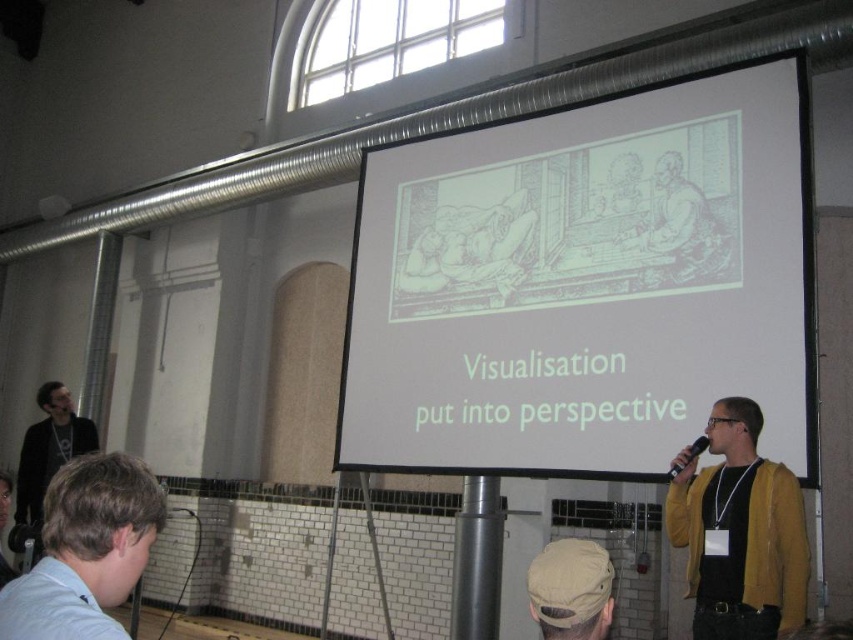
You are standing in the presentation room and want to locate the presenter wearing the yellow cardigan at right. According to the coordinates provided, where exactly should you look to find him?

You should look towards the right side of the image at point coordinates (740, 531) to find the presenter wearing the yellow cardigan at right.

You are standing in the room where the presentation is happening. You need to locate the light blue shirt at lower left. According to the coordinates given, where exactly should you look to find it?

The light blue shirt at lower left is located at coordinates point (86, 550).